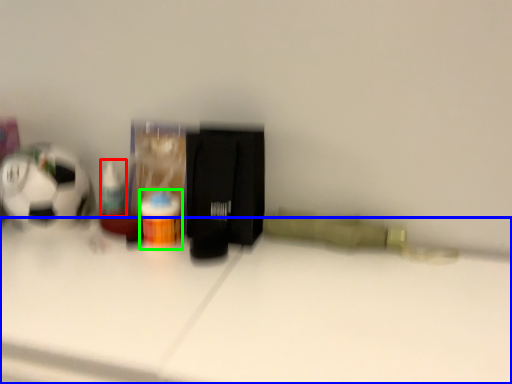
Question: Considering the real-world distances, which object is farthest from toiletry (highlighted by a red box)? table (highlighted by a blue box) or bottle (highlighted by a green box)?

Choices:
 (A) table
 (B) bottle

Answer: (A)